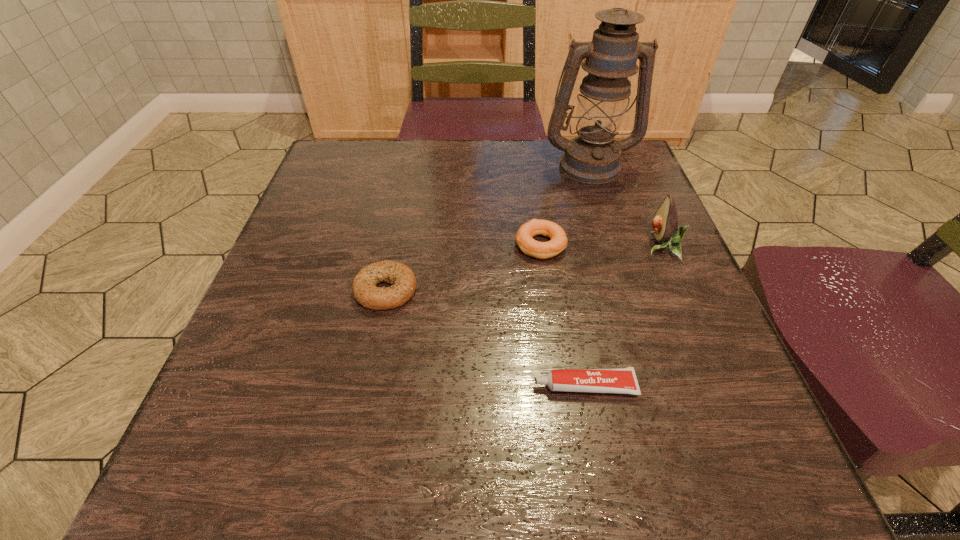
Where is `free space located 0.350m on the seed side of the avocado`? free space located 0.350m on the seed side of the avocado is located at coordinates (471, 246).

What are the coordinates of `vacant space situated 0.200m on the seed side of the avocado` in the screenshot? It's located at (546, 246).

Image resolution: width=960 pixels, height=540 pixels. What are the coordinates of `free space located on the front of the nearer bagel` in the screenshot? It's located at (375, 342).

The image size is (960, 540). In order to click on vacant position located on the front of the right bagel in this screenshot , I will do `click(550, 315)`.

Image resolution: width=960 pixels, height=540 pixels. I want to click on free spot located 0.290m at the nozzle of the toothpaste, so click(x=341, y=386).

Where is `vacant space located at the nozzle of the toothpaste`? This screenshot has height=540, width=960. vacant space located at the nozzle of the toothpaste is located at coordinates pos(407,386).

I want to click on vacant position located 0.090m at the nozzle of the toothpaste, so click(x=474, y=386).

Where is `object that is at the far edge`? object that is at the far edge is located at coordinates (592, 157).

At what (x,y) coordinates should I click in order to perform the action: click on oil lamp situated at the right edge. Please return your answer as a coordinate pair (x, y). This screenshot has height=540, width=960. Looking at the image, I should click on (592, 157).

The image size is (960, 540). Find the location of `avocado located at the right edge`. avocado located at the right edge is located at coordinates (665, 222).